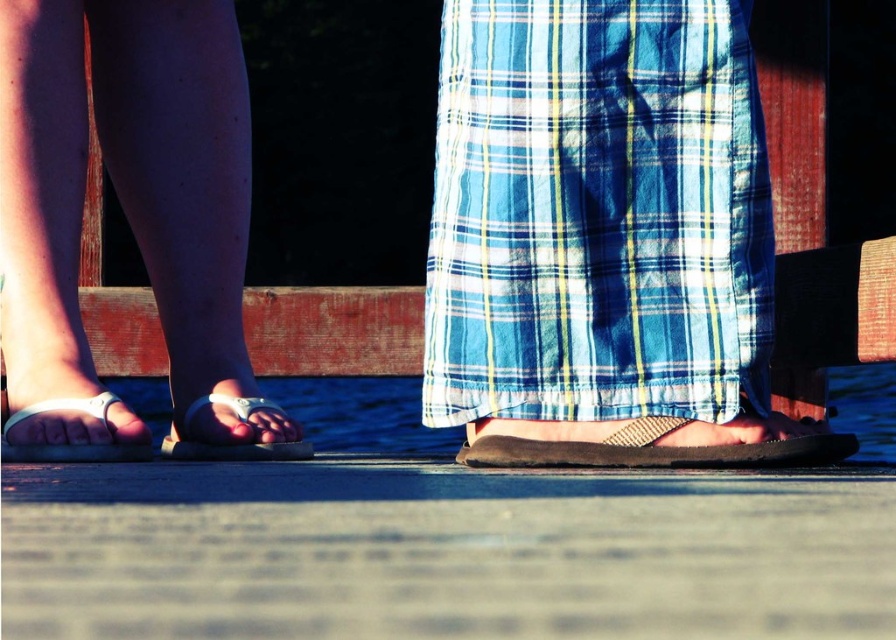
Between brown suede sandal at center and white leather sandal at lower center, which one has less height?

With less height is brown suede sandal at center.

Between point (488, 438) and point (185, 424), which one is positioned in front?

Point (488, 438) is in front.

At what (x,y) coordinates should I click in order to perform the action: click on brown suede sandal at center. Please return your answer as a coordinate pair (x, y). This screenshot has width=896, height=640. Looking at the image, I should click on (664, 448).

Is white plastic sandals at left to the right of white plastic sandal at lower left from the viewer's perspective?

Correct, you'll find white plastic sandals at left to the right of white plastic sandal at lower left.

Is white plastic sandals at left shorter than white plastic sandal at lower left?

No.

Which is behind, point (154, 68) or point (138, 456)?

Point (154, 68)

Image resolution: width=896 pixels, height=640 pixels. Find the location of `white plastic sandals at left`. white plastic sandals at left is located at coordinates (128, 224).

In the scene shown: Who is lower down, white plastic sandals at left or white leather sandal at lower center?

white leather sandal at lower center is below.

Is white plastic sandals at left behind white leather sandal at lower center?

No, white plastic sandals at left is closer to the viewer.

Locate an element on the screen. white plastic sandals at left is located at coordinates (128, 224).

You are a GUI agent. You are given a task and a screenshot of the screen. Output one action in this format:
    pyautogui.click(x=<x>, y=<y>)
    Task: Click on the white plastic sandals at left
    
    Given the screenshot: What is the action you would take?
    pyautogui.click(x=128, y=224)